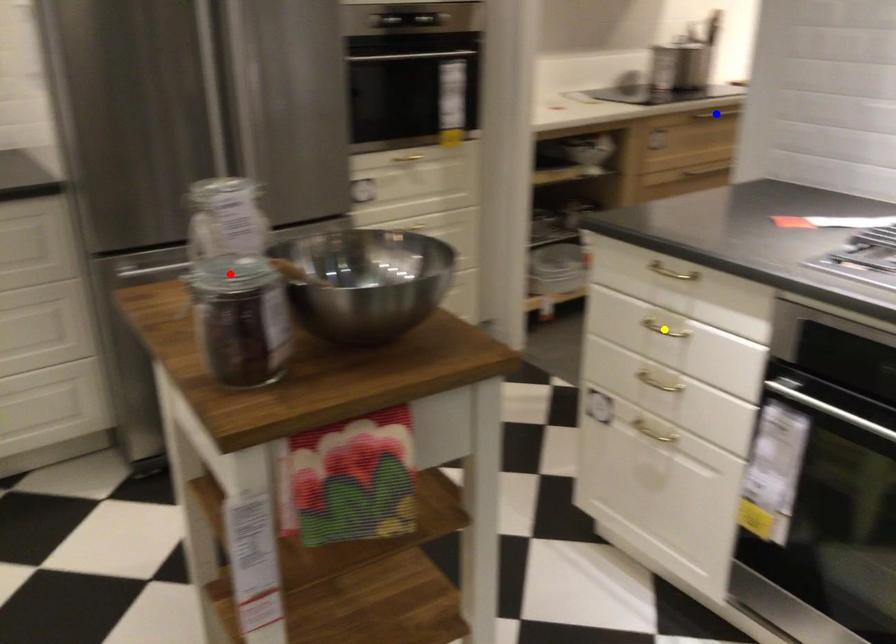
Order these from farthest to nearest:
blue point
yellow point
red point

blue point, yellow point, red point